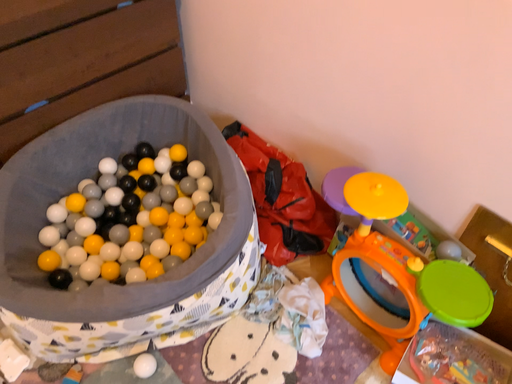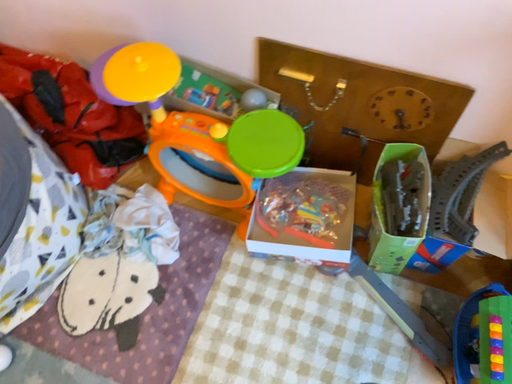
Question: Which way did the camera rotate in the video?

Choices:
 (A) rotated left
 (B) rotated right

Answer: (B)